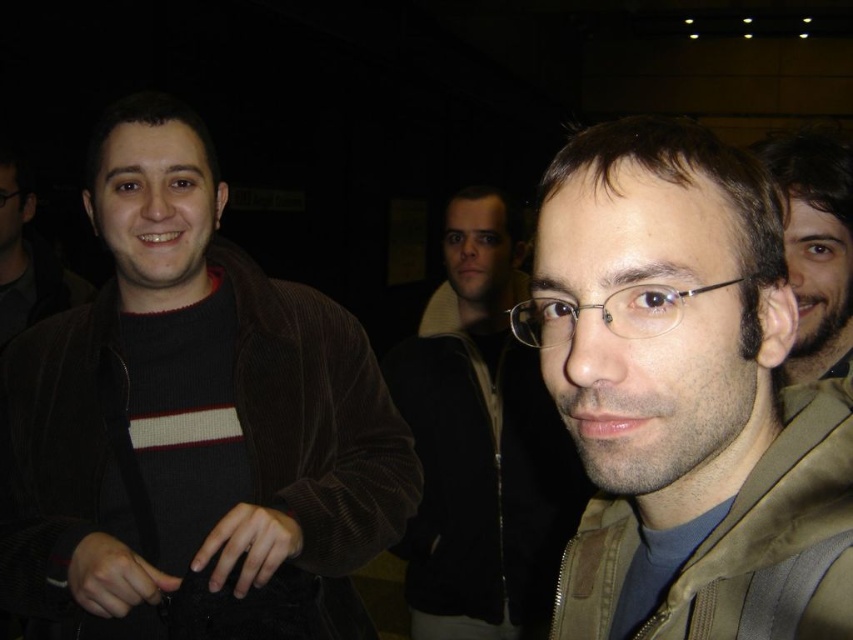
You are at a party and need to choose between the clear plastic glasses at center and the matte black glasses at left for serving drinks. Which pair of glasses has a bigger capacity?

The clear plastic glasses at center has a larger size compared to matte black glasses at left, so they likely have a bigger capacity.